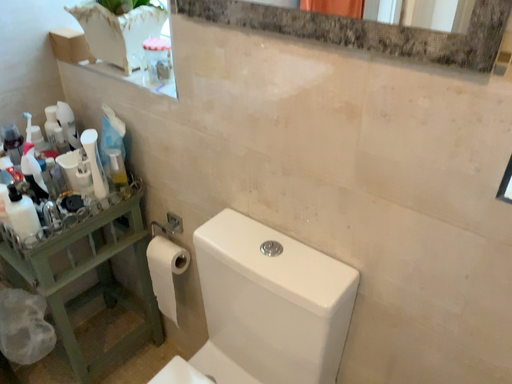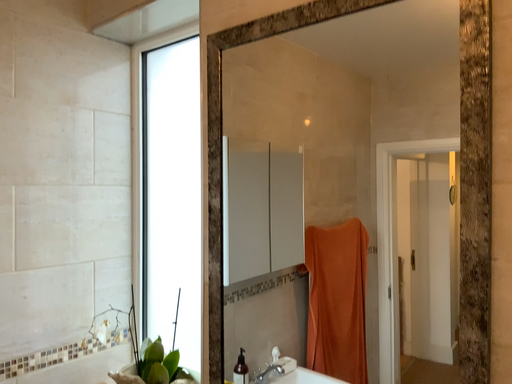
Question: Which way did the camera rotate in the video?

Choices:
 (A) rotated downward
 (B) rotated upward

Answer: (B)